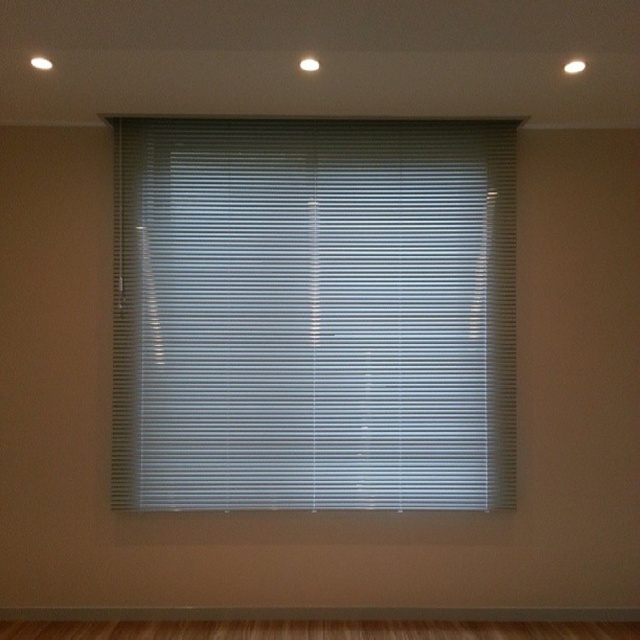
Question: Which point appears closest to the camera in this image?

Choices:
 (A) (524, 627)
 (B) (452, 385)

Answer: (A)

Question: Is white matte blinds at center to the left of brown wood flooring at bottom from the viewer's perspective?

Choices:
 (A) no
 (B) yes

Answer: (B)

Question: Among these objects, which one is farthest from the camera?

Choices:
 (A) brown wood flooring at bottom
 (B) white matte blinds at center

Answer: (B)

Question: Is white matte blinds at center thinner than brown wood flooring at bottom?

Choices:
 (A) no
 (B) yes

Answer: (B)

Question: Can you confirm if white matte blinds at center is thinner than brown wood flooring at bottom?

Choices:
 (A) yes
 (B) no

Answer: (A)